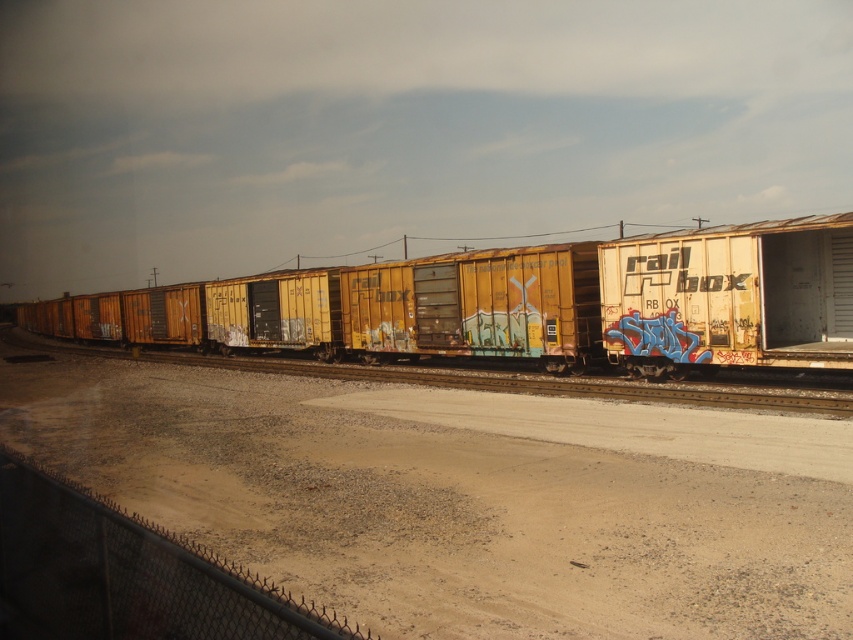
You are standing at the point labeled as point (463, 499) in the image. What is the name of the object you are currently standing on?

The point labeled as point (463, 499) is located on the brown gravel dirt track at center.

You are standing near the railway tracks and want to determine which of the two points, point (238, 456) or point (561, 317), is closer to you. Based on the image, which point is nearer?

Point (238, 456) is closer to the viewer than point (561, 317).

You are a maintenance worker assessing the train cars. Which of the two cars, the yellow weathered boxcar at center or the yellow matte train car at center, requires a taller ladder to access the roof?

The yellow weathered boxcar at center requires a taller ladder because it is much taller than the yellow matte train car at center.